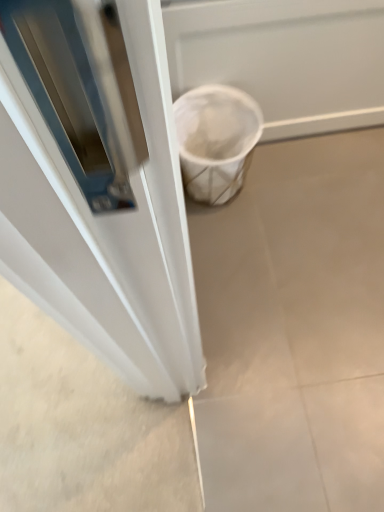
Question: Is point (344, 268) closer or farther from the camera than point (317, 105)?

Choices:
 (A) farther
 (B) closer

Answer: (B)

Question: In the image, is white matte trash can at lower right positioned in front of or behind white mesh screen door at lower right?

Choices:
 (A) front
 (B) behind

Answer: (B)

Question: Considering the positions of white matte trash can at lower right and white mesh screen door at lower right in the image, is white matte trash can at lower right taller or shorter than white mesh screen door at lower right?

Choices:
 (A) tall
 (B) short

Answer: (B)

Question: Would you say white mesh screen door at lower right is to the left or to the right of white matte trash can at lower right in the picture?

Choices:
 (A) right
 (B) left

Answer: (A)

Question: Is white mesh screen door at lower right taller or shorter than white matte trash can at lower right?

Choices:
 (A) tall
 (B) short

Answer: (A)

Question: Considering the positions of white mesh screen door at lower right and white matte trash can at lower right in the image, is white mesh screen door at lower right bigger or smaller than white matte trash can at lower right?

Choices:
 (A) big
 (B) small

Answer: (A)

Question: From the image's perspective, is white mesh screen door at lower right above or below white matte trash can at lower right?

Choices:
 (A) above
 (B) below

Answer: (A)